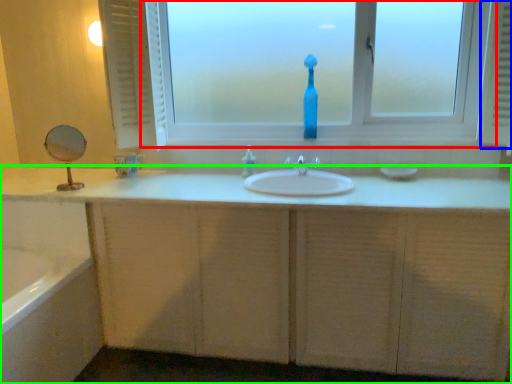
Question: Based on their relative distances, which object is farther from window (highlighted by a red box)? Choose from radiator (highlighted by a blue box) and bathroom cabinet (highlighted by a green box).

Choices:
 (A) radiator
 (B) bathroom cabinet

Answer: (B)